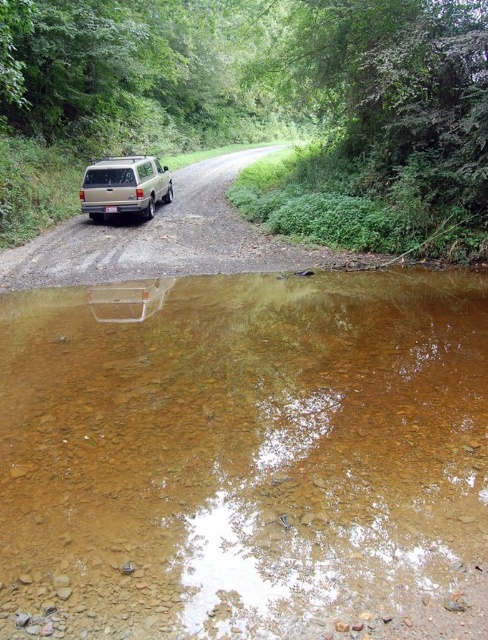
Is brown rocky stream at center taller than gold metallic minivan at center?

Incorrect, brown rocky stream at center's height is not larger of gold metallic minivan at center's.

Which of these two, brown rocky stream at center or gold metallic minivan at center, stands taller?

With more height is gold metallic minivan at center.

Does point (13, 368) come closer to viewer compared to point (159, 168)?

That is True.

Where is `brown rocky stream at center`? This screenshot has width=488, height=640. brown rocky stream at center is located at coordinates (244, 458).

Does brown rocky stream at center have a smaller size compared to silver metallic suv at left?

Correct, brown rocky stream at center occupies less space than silver metallic suv at left.

Does brown rocky stream at center appear on the left side of silver metallic suv at left?

In fact, brown rocky stream at center is to the right of silver metallic suv at left.

The width and height of the screenshot is (488, 640). What do you see at coordinates (244, 458) in the screenshot?
I see `brown rocky stream at center` at bounding box center [244, 458].

Identify the location of brown rocky stream at center. Image resolution: width=488 pixels, height=640 pixels. [244, 458].

Is silver metallic suv at left shorter than gold metallic minivan at center?

No, silver metallic suv at left is not shorter than gold metallic minivan at center.

Is silver metallic suv at left below gold metallic minivan at center?

No.

Is point (366, 20) in front of point (123, 157)?

Yes.

This screenshot has height=640, width=488. Identify the location of silver metallic suv at left. (260, 108).